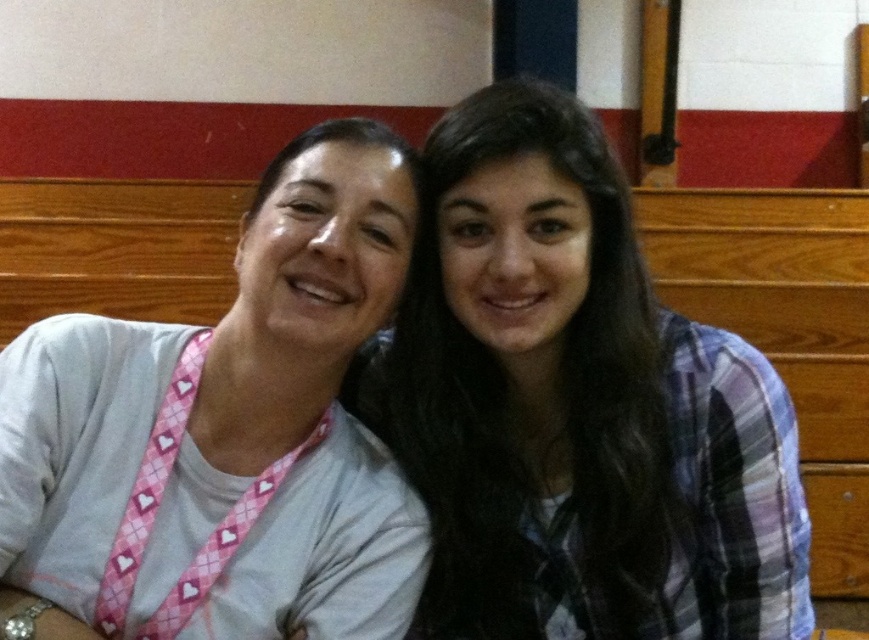
Which is above, plaid fabric shirt at center or pink argyle lanyard at left?

pink argyle lanyard at left

Who is positioned more to the left, plaid fabric shirt at center or pink argyle lanyard at left?

From the viewer's perspective, pink argyle lanyard at left appears more on the left side.

Between point (453, 339) and point (328, 125), which one is positioned behind?

Point (453, 339)

You are a GUI agent. You are given a task and a screenshot of the screen. Output one action in this format:
    pyautogui.click(x=<x>, y=<y>)
    Task: Click on the plaid fabric shirt at center
    This screenshot has width=869, height=640.
    Given the screenshot: What is the action you would take?
    pyautogui.click(x=575, y=406)